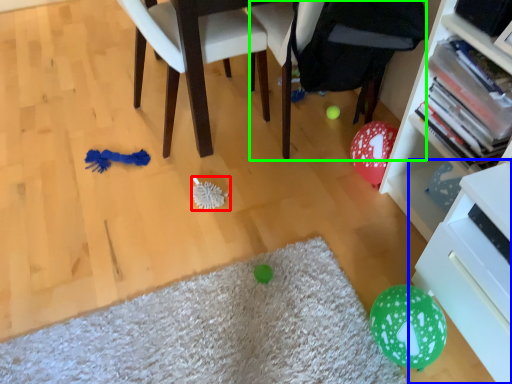
Question: Which object is positioned closest to brush (highlighted by a red box)? Select from shelf (highlighted by a blue box) and bean bag chair (highlighted by a green box).

Choices:
 (A) shelf
 (B) bean bag chair

Answer: (B)